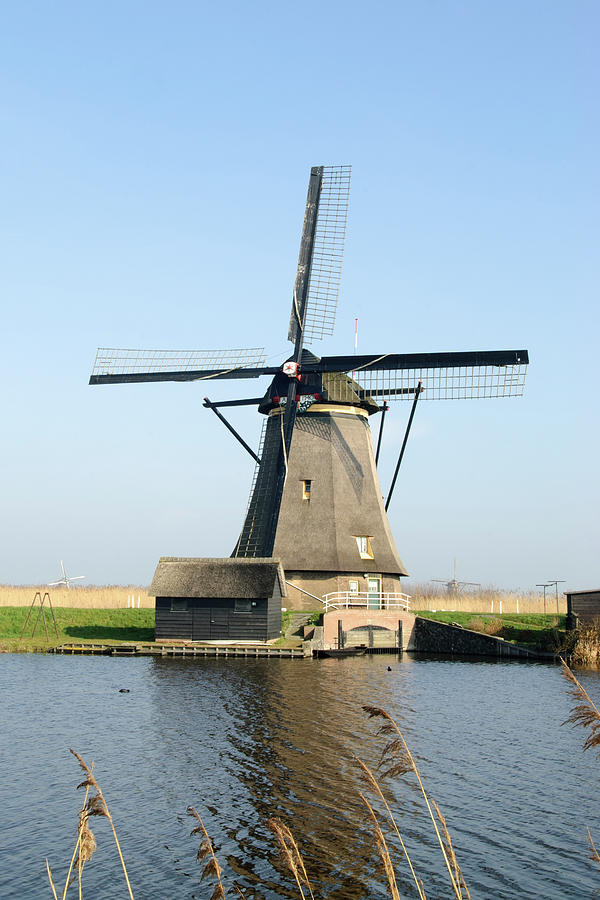
At what (x,y) coordinates should I click in order to perform the action: click on doors. Please return your answer as a coordinate pair (x, y). The width and height of the screenshot is (600, 900). Looking at the image, I should click on (200, 630), (216, 630), (372, 583).